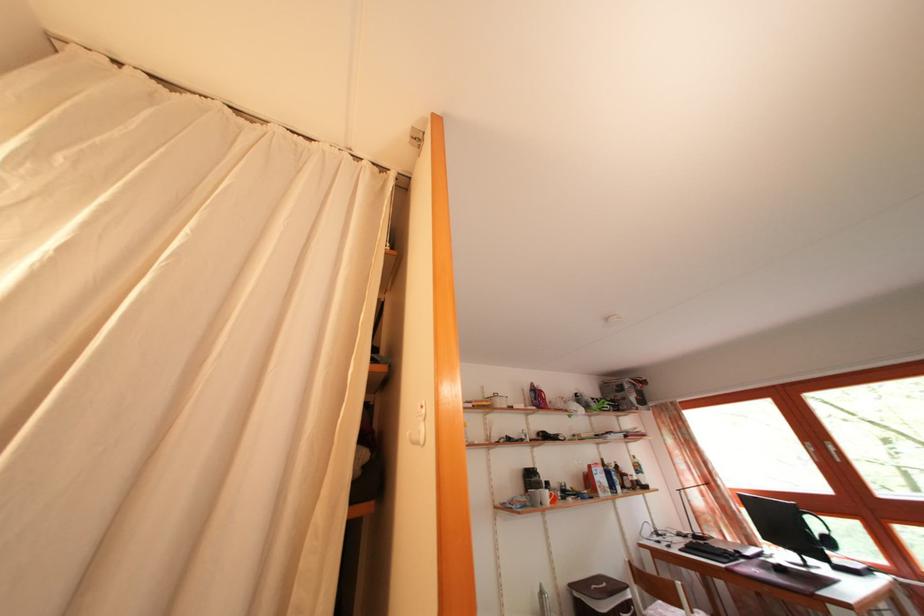
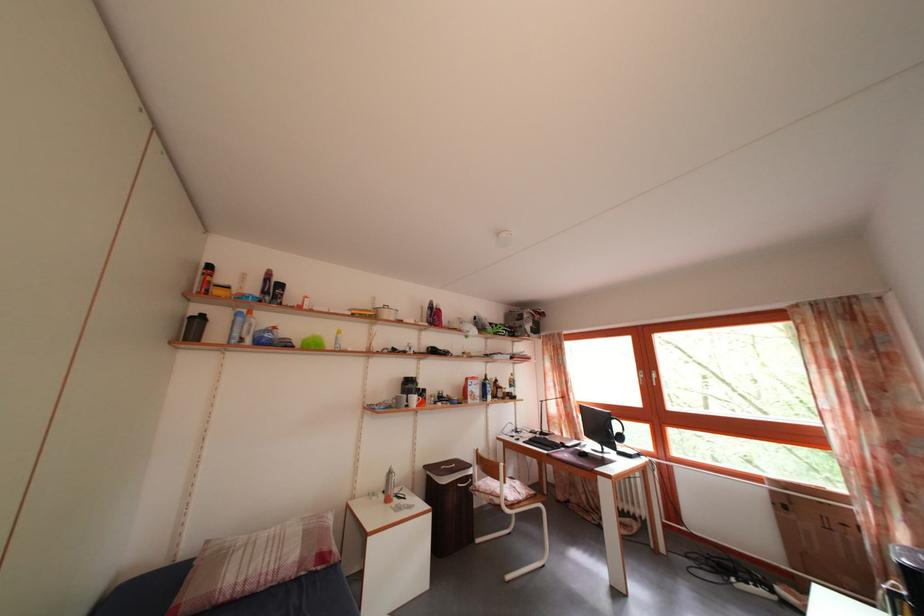
Where in the second image is the point corresponding to point 821,533 from the first image?

(624, 434)